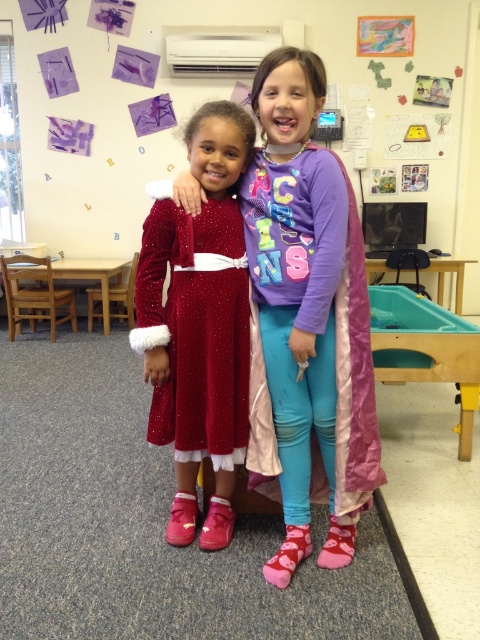
Does velvet shiny dress at center appear over pink satin cape at center?

Incorrect, velvet shiny dress at center is not positioned above pink satin cape at center.

Based on the photo, does velvet shiny dress at center have a smaller size compared to pink satin cape at center?

Yes, velvet shiny dress at center is smaller than pink satin cape at center.

Identify the location of velvet shiny dress at center. The width and height of the screenshot is (480, 640). (195, 330).

Locate an element on the screen. The image size is (480, 640). velvet shiny dress at center is located at coordinates (195, 330).